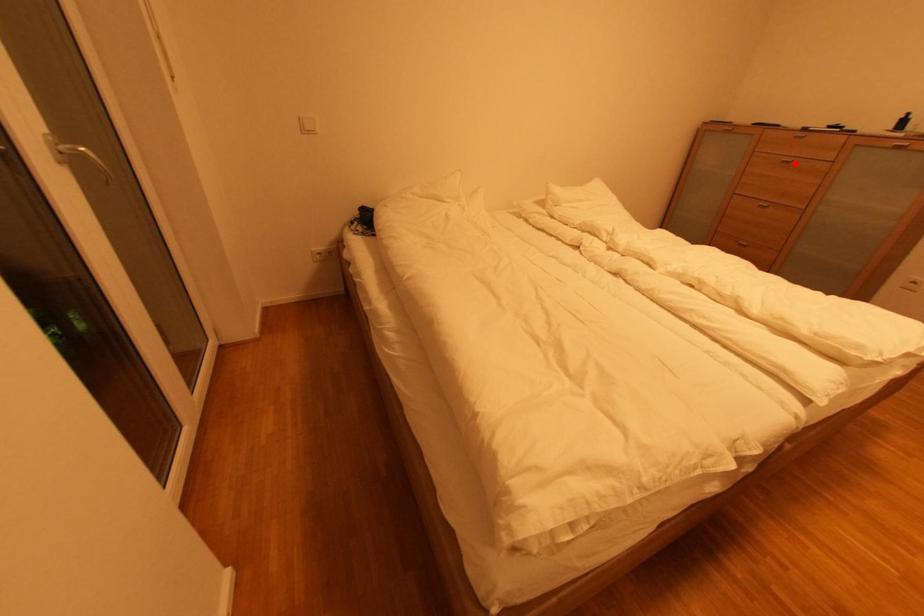
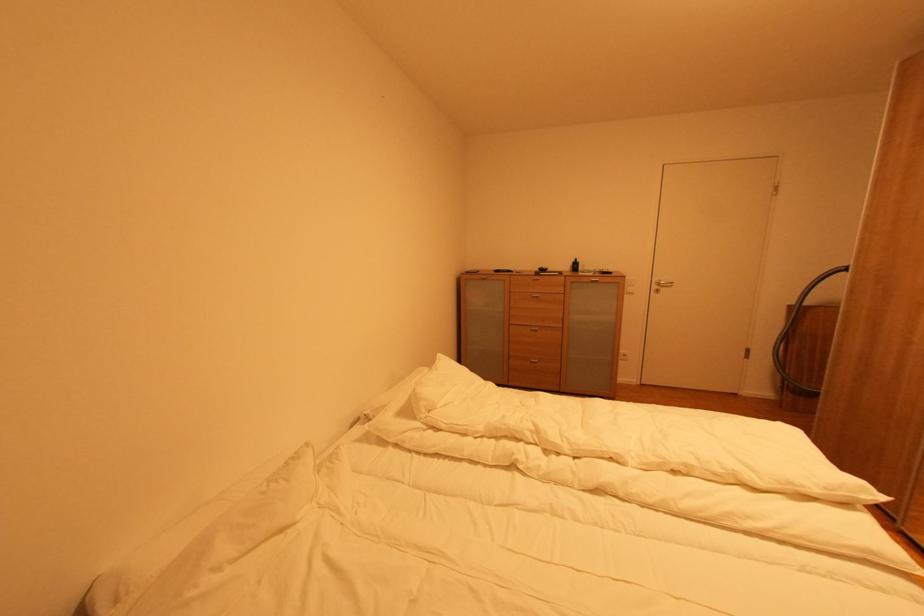
In the second image, find the point that corresponds to the highlighted location in the first image.

(542, 298)